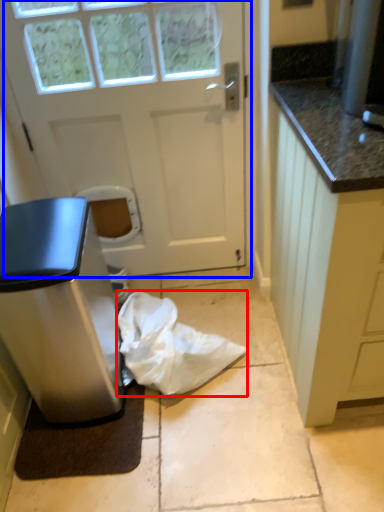
Question: Which of the following is the closest to the observer, material (highlighted by a red box) or door (highlighted by a blue box)?

Choices:
 (A) material
 (B) door

Answer: (B)